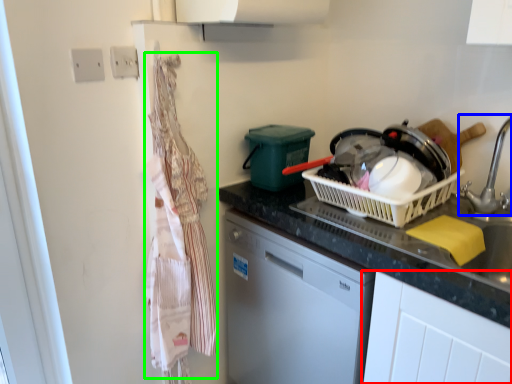
Question: Which is nearer to the cabinetry (highlighted by a red box)? faucet (highlighted by a blue box) or laundry (highlighted by a green box).

Choices:
 (A) faucet
 (B) laundry

Answer: (A)